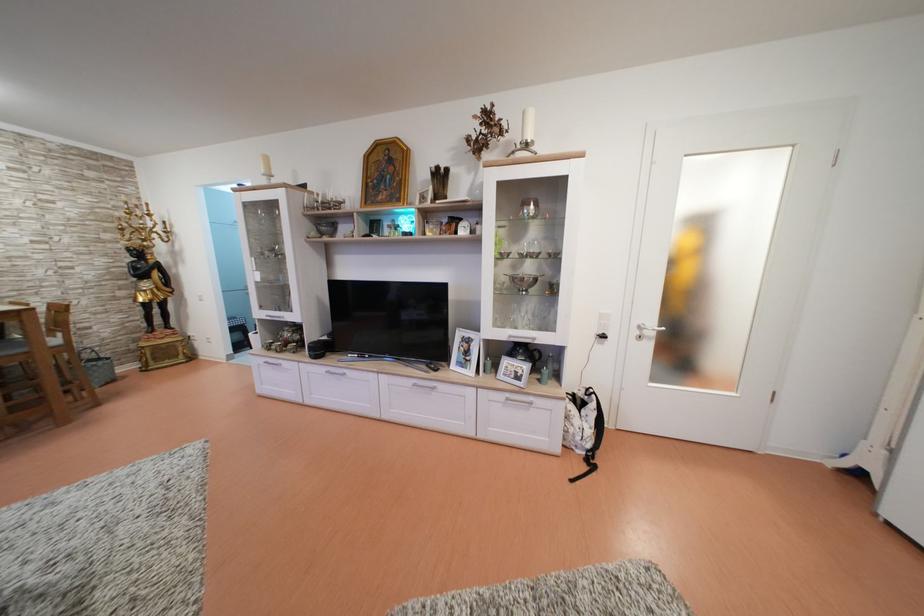
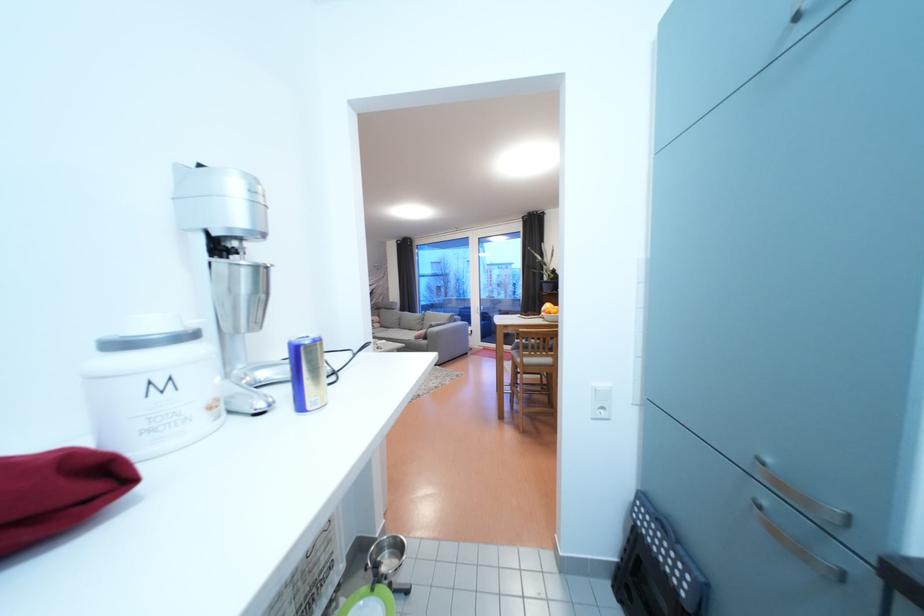
Question: I am providing you with two images of the same scene from different viewpoints. Please identify which objects are invisible in image2.

Choices:
 (A) large open box
 (B) metal scoop
 (C) white container lid
 (D) chair sitting surface

Answer: (D)